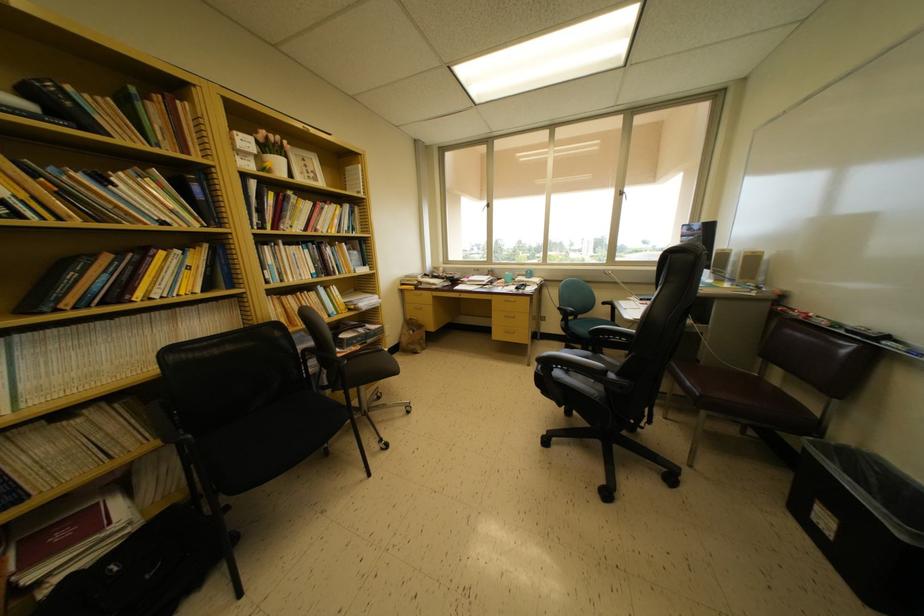
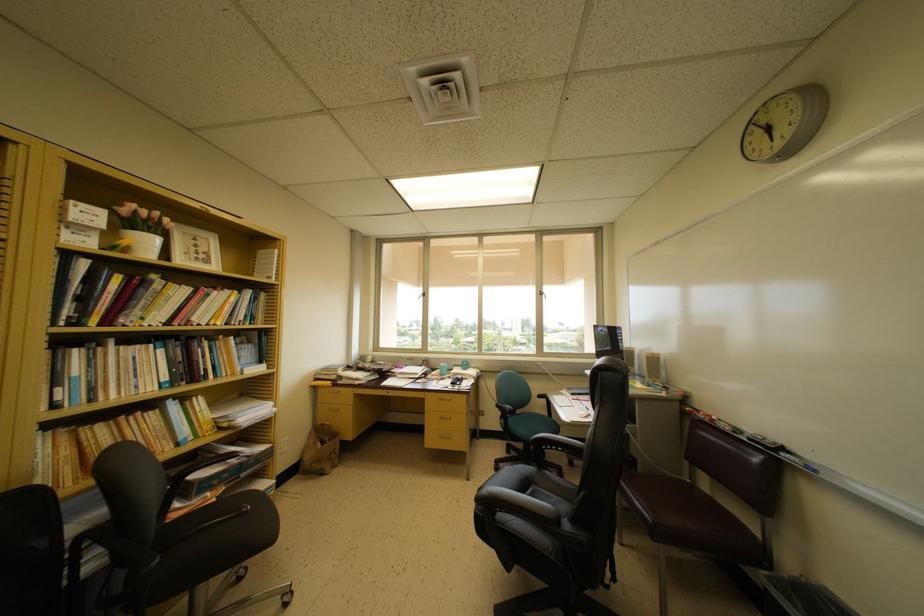
Find the pixel in the second image that matches pixel 407 349 in the first image.

(310, 468)